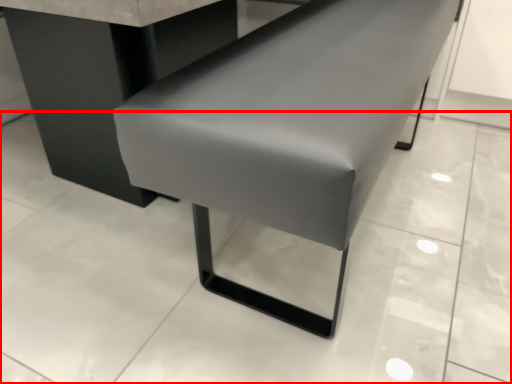
Question: Considering the relative positions of concrete (annotated by the red box) and furniture in the image provided, where is concrete (annotated by the red box) located with respect to the staircase?

Choices:
 (A) right
 (B) left

Answer: (B)